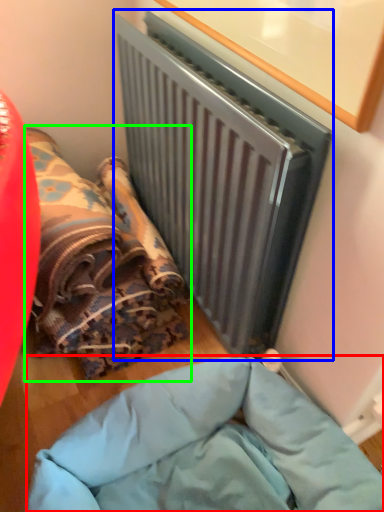
Question: Which object is positioned closest to furniture (highlighted by a red box)? Select from radiator (highlighted by a blue box) and bean bag chair (highlighted by a green box).

Choices:
 (A) radiator
 (B) bean bag chair

Answer: (B)